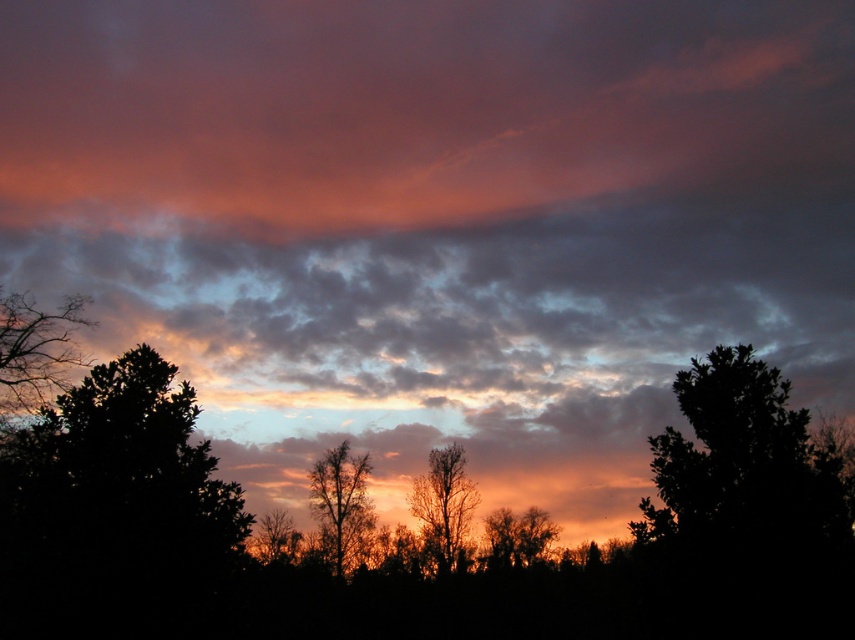
Measure the distance between dark green leafy tree at left and camera.

The distance of dark green leafy tree at left from camera is 58.96 feet.

Who is positioned more to the right, dark green leafy tree at left or silhouette bare tree at center?

From the viewer's perspective, silhouette bare tree at center appears more on the right side.

Find the location of a particular element. The width and height of the screenshot is (855, 640). dark green leafy tree at left is located at coordinates (115, 512).

Between dark green leafy tree at left and dark green leafy tree at right, which one appears on the right side from the viewer's perspective?

dark green leafy tree at right is more to the right.

Who is more distant from viewer, [104,458] or [800,419]?

The point [800,419] is more distant.

Is point (149, 401) less distant than point (715, 412)?

Yes, point (149, 401) is closer to viewer.

Locate an element on the screen. dark green leafy tree at left is located at coordinates (115, 512).

Does bare branches at left have a larger size compared to silhouette bare tree at center?

Yes, bare branches at left is bigger than silhouette bare tree at center.

Which is more to the right, bare branches at left or silhouette bare tree at center?

From the viewer's perspective, silhouette bare tree at center appears more on the right side.

Where is `bare branches at left`? The image size is (855, 640). bare branches at left is located at coordinates (34, 349).